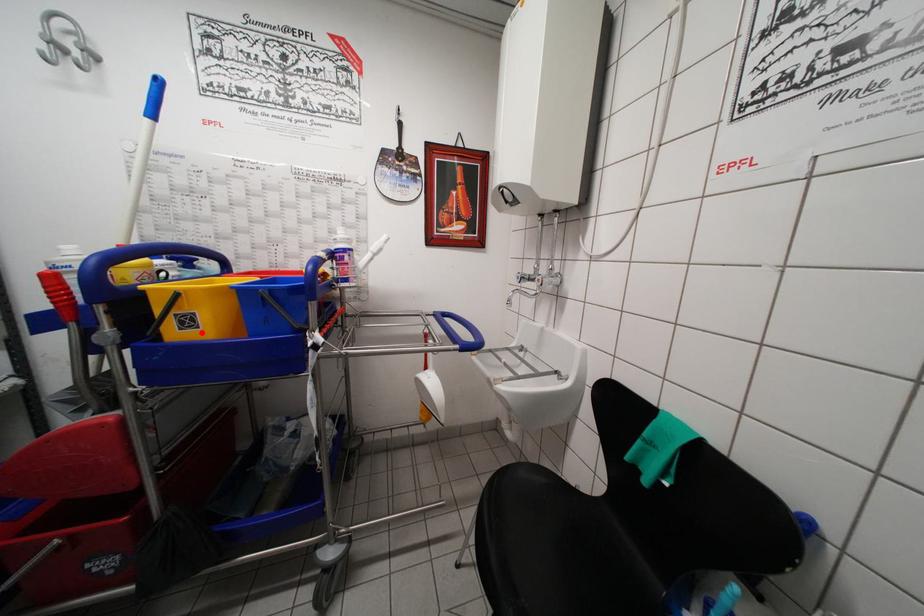
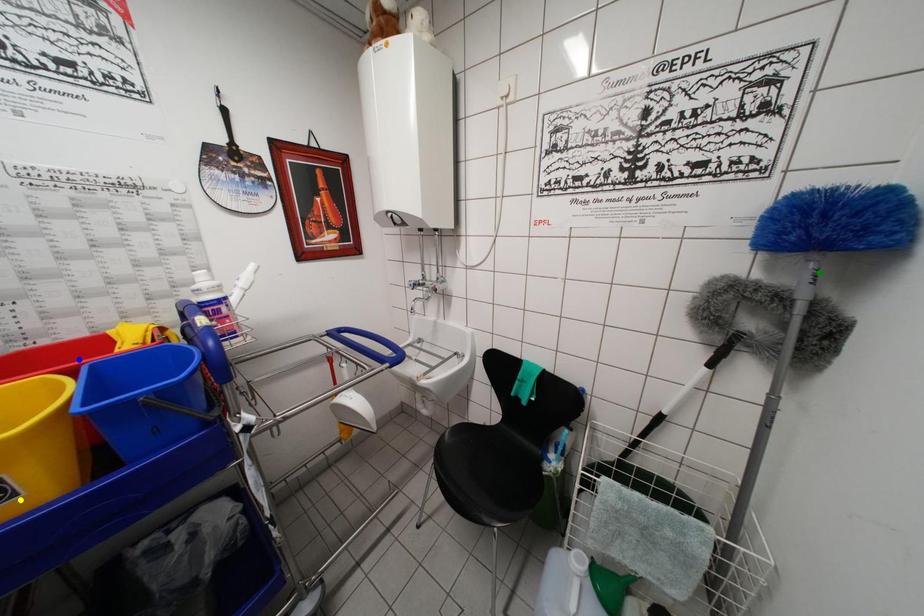
Question: I am providing you with two images of the same scene from different viewpoints. A red point is marked on the first image. You are given multiple points on the second image. Which point in image 2 represents the same 3d spot as the red point in image 1?

Choices:
 (A) green point
 (B) blue point
 (C) yellow point

Answer: (C)